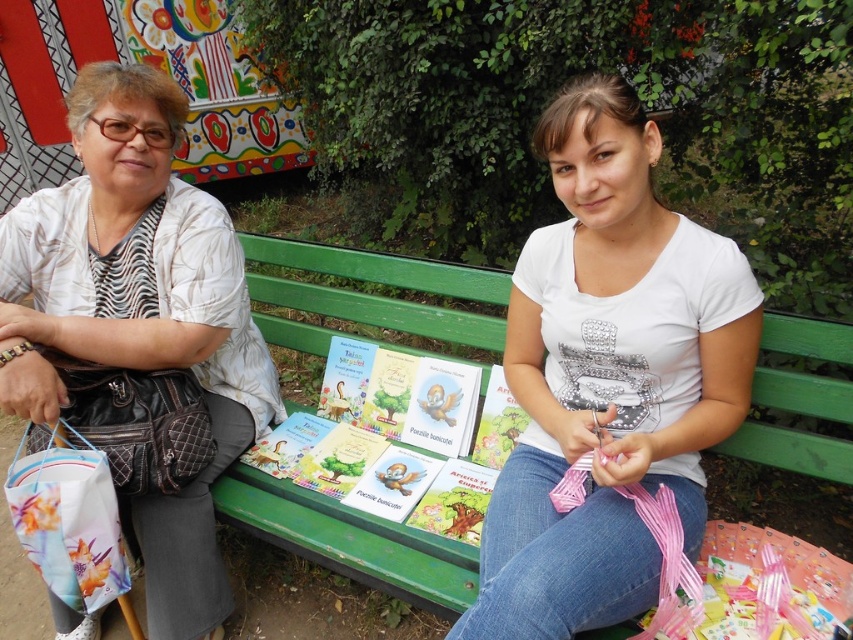
Which is more to the right, white matte shirt at center or matte paper book at center?

white matte shirt at center

Which is below, white matte shirt at center or matte paper book at center?

matte paper book at center is lower down.

Who is more forward, (592,570) or (392,385)?

Point (592,570)

You are a GUI agent. You are given a task and a screenshot of the screen. Output one action in this format:
    pyautogui.click(x=<x>, y=<y>)
    Task: Click on the white matte shirt at center
    
    Given the screenshot: What is the action you would take?
    pyautogui.click(x=608, y=376)

Does white textured jacket at upper left appear over green painted wood park bench at center?

No, white textured jacket at upper left is not above green painted wood park bench at center.

Between point (178, 262) and point (451, 316), which one is positioned behind?

Point (451, 316)

Identify the location of white textured jacket at upper left. (138, 314).

Can you confirm if green painted wood park bench at center is bigger than matte paper book at center?

Yes, green painted wood park bench at center is bigger than matte paper book at center.

Locate an element on the screen. This screenshot has width=853, height=640. green painted wood park bench at center is located at coordinates (350, 540).

Who is more forward, (763, 376) or (370, 401)?

Positioned in front is point (763, 376).

Where is `green painted wood park bench at center`? green painted wood park bench at center is located at coordinates click(350, 540).